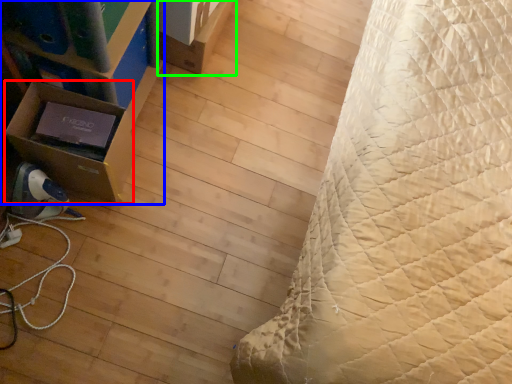
Question: Considering the real-world distances, which object is closest to cardboard box (highlighted by a red box)? furniture (highlighted by a blue box) or cardboard box (highlighted by a green box).

Choices:
 (A) furniture
 (B) cardboard box

Answer: (A)